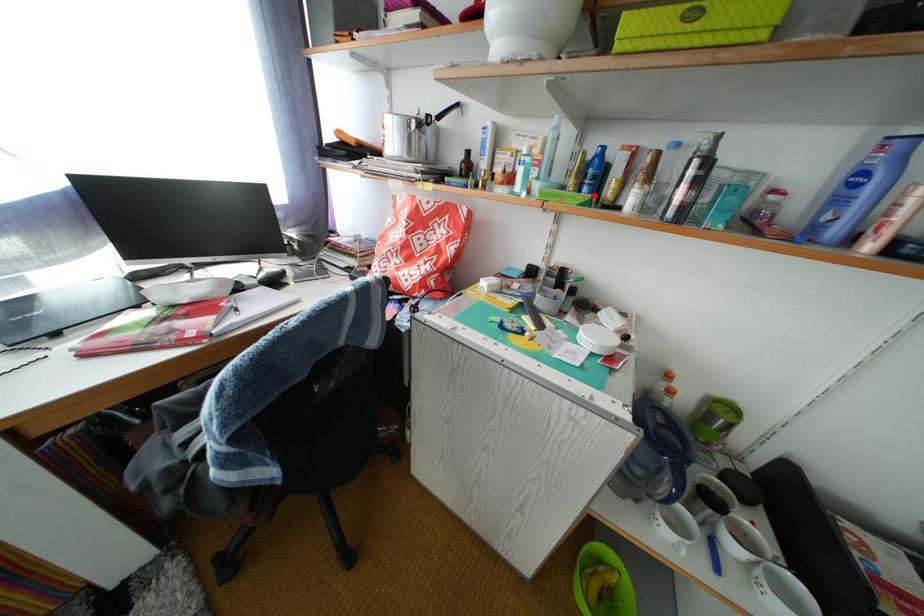
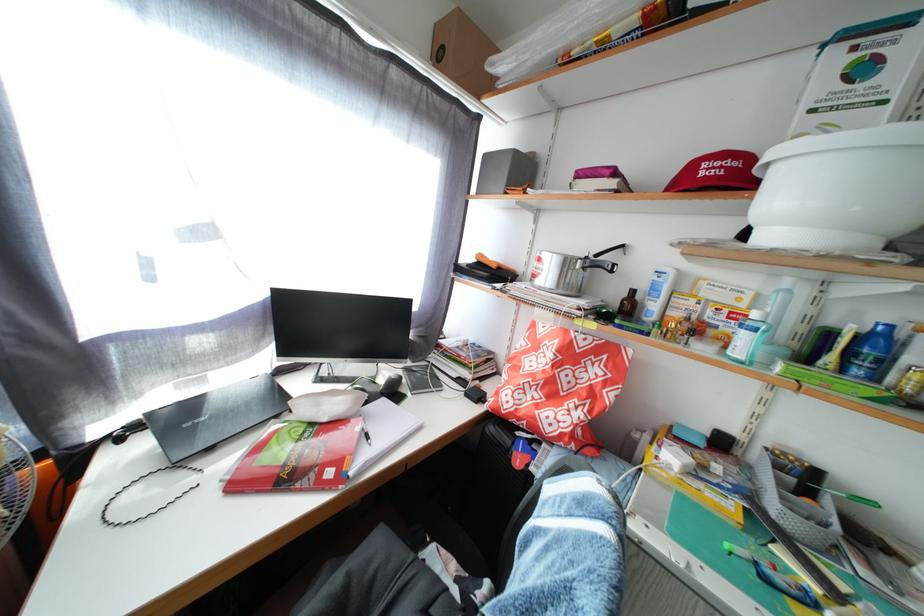
Question: I am providing you with two images of the same scene from different viewpoints. In image1, a red point is highlighted. Considering the same 3D point in image2, which of the following is correct?

Choices:
 (A) It is closer
 (B) It is farther

Answer: (B)